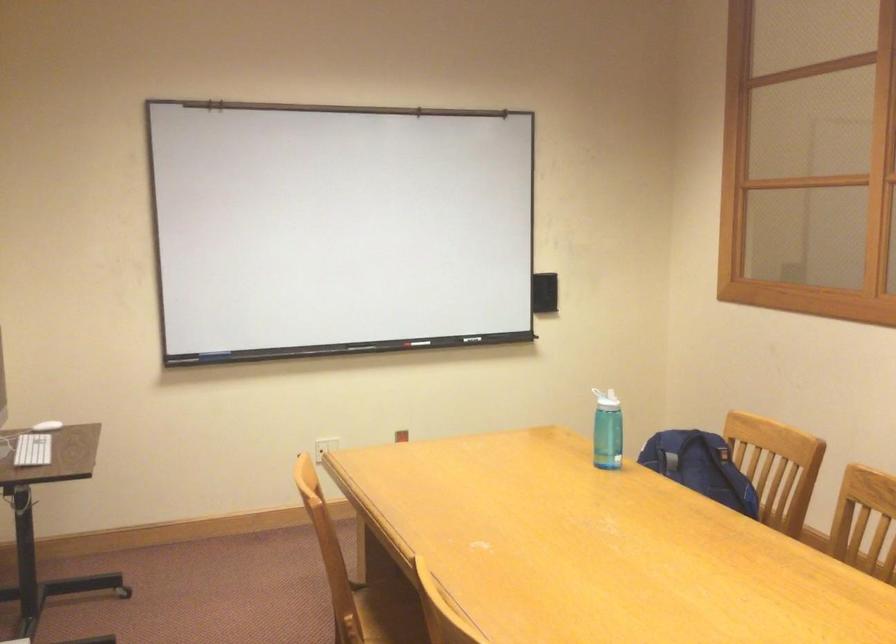
This screenshot has width=896, height=644. In order to click on blue water bottle in this screenshot , I will do `click(607, 430)`.